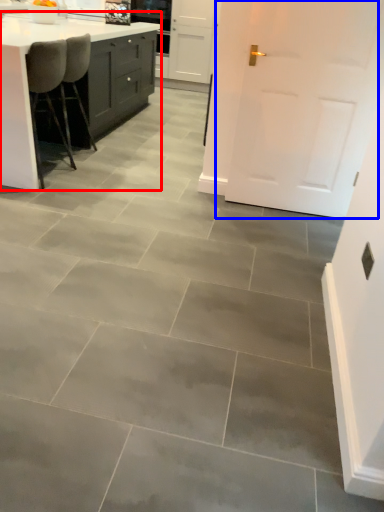
Question: Which point is closer to the camera, countertop (highlighted by a red box) or door (highlighted by a blue box)?

Choices:
 (A) countertop
 (B) door

Answer: (B)